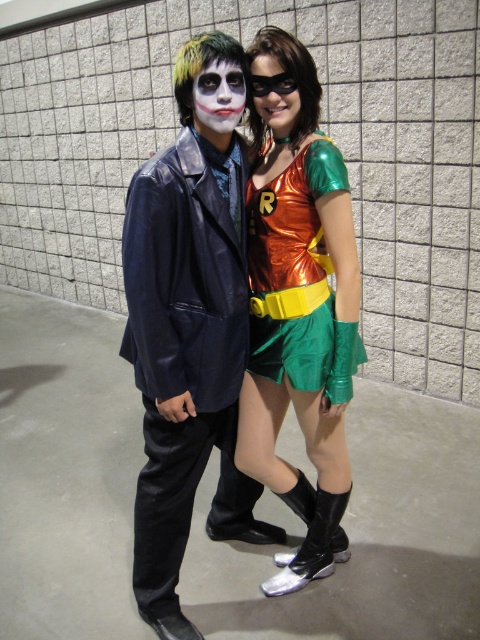
Who is positioned more to the left, matte white face at center or metallic gold mask at center?

matte white face at center

Locate an element on the screen. matte white face at center is located at coordinates (217, 97).

Measure the distance from shiny black suit at center to metallic gold mask at center.

19.71 inches

Is shiny black suit at center below metallic gold mask at center?

Indeed, shiny black suit at center is positioned under metallic gold mask at center.

Does point (192, 275) come farther from viewer compared to point (261, 106)?

No, (192, 275) is closer to viewer.

The height and width of the screenshot is (640, 480). I want to click on shiny black suit at center, so click(188, 340).

Can you confirm if metallic green shorts at center is taller than metallic gold mask at center?

Yes.

Can you confirm if metallic green shorts at center is positioned below metallic gold mask at center?

Correct, metallic green shorts at center is located below metallic gold mask at center.

Does point (255, 342) lie in front of point (254, 60)?

No, (255, 342) is further to viewer.

This screenshot has height=640, width=480. I want to click on metallic green shorts at center, so click(x=300, y=317).